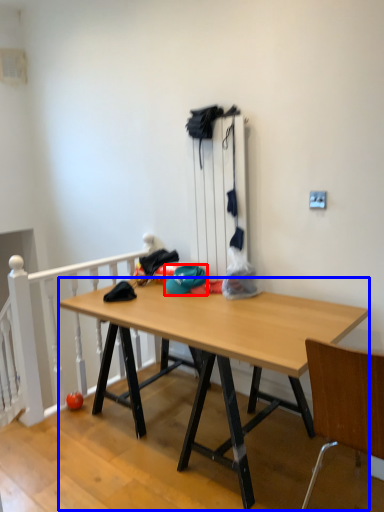
Question: Which point is further to the camera, hat (highlighted by a red box) or desk (highlighted by a blue box)?

Choices:
 (A) hat
 (B) desk

Answer: (A)